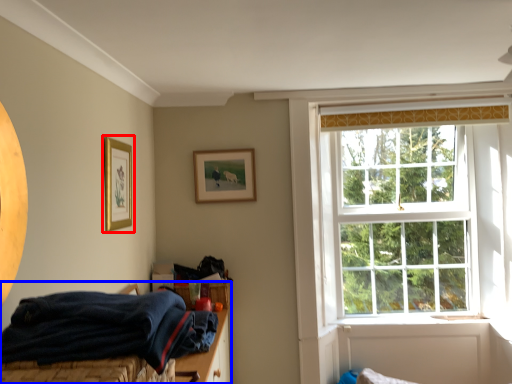
Question: Which of the following is the farthest to the observer, picture frame (highlighted by a red box) or bed (highlighted by a blue box)?

Choices:
 (A) picture frame
 (B) bed

Answer: (A)